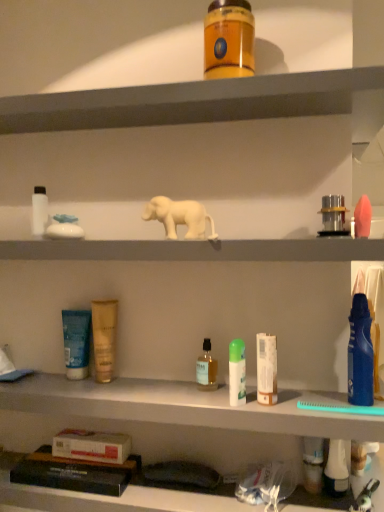
Question: Does pink matte sponge at right, which is the twelfth toiletry in left-to-right order, have a lesser width compared to metallic silver canister at upper right, the 9th toiletry when ordered from left to right?

Choices:
 (A) no
 (B) yes

Answer: (A)

Question: Does pink matte sponge at right, the first toiletry in the right-to-left sequence, have a smaller size compared to metallic silver canister at upper right, the 9th toiletry when ordered from left to right?

Choices:
 (A) yes
 (B) no

Answer: (B)

Question: Does pink matte sponge at right, which is the twelfth toiletry in left-to-right order, have a lesser height compared to metallic silver canister at upper right, positioned as the 4th toiletry in right-to-left order?

Choices:
 (A) no
 (B) yes

Answer: (A)

Question: Is pink matte sponge at right, which is the twelfth toiletry in left-to-right order, looking in the opposite direction of metallic silver canister at upper right, positioned as the 4th toiletry in right-to-left order?

Choices:
 (A) no
 (B) yes

Answer: (A)

Question: Can we say pink matte sponge at right, which is the twelfth toiletry in left-to-right order, lies outside metallic silver canister at upper right, positioned as the 4th toiletry in right-to-left order?

Choices:
 (A) no
 (B) yes

Answer: (B)

Question: Is pink matte sponge at right, which is the twelfth toiletry in left-to-right order, to the left or to the right of metallic silver canister at upper right, the 9th toiletry when ordered from left to right, in the image?

Choices:
 (A) right
 (B) left

Answer: (A)

Question: Is pink matte sponge at right, which is the twelfth toiletry in left-to-right order, taller or shorter than metallic silver canister at upper right, the 9th toiletry when ordered from left to right?

Choices:
 (A) short
 (B) tall

Answer: (A)

Question: From the image's perspective, is pink matte sponge at right, which is the twelfth toiletry in left-to-right order, positioned above or below metallic silver canister at upper right, the 9th toiletry when ordered from left to right?

Choices:
 (A) above
 (B) below

Answer: (B)

Question: Considering the positions of pink matte sponge at right, which is the twelfth toiletry in left-to-right order, and metallic silver canister at upper right, positioned as the 4th toiletry in right-to-left order, in the image, is pink matte sponge at right, which is the twelfth toiletry in left-to-right order, bigger or smaller than metallic silver canister at upper right, positioned as the 4th toiletry in right-to-left order,?

Choices:
 (A) small
 (B) big

Answer: (B)

Question: Is translucent glass bottle at center, placed as the fourth toiletry when sorted from left to right, wider or thinner than white matte bottle at left, marked as the 12th toiletry in a right-to-left arrangement?

Choices:
 (A) thin
 (B) wide

Answer: (A)

Question: Based on their positions, is translucent glass bottle at center, placed as the fourth toiletry when sorted from left to right, located to the left or right of white matte bottle at left, marked as the 12th toiletry in a right-to-left arrangement?

Choices:
 (A) right
 (B) left

Answer: (A)

Question: Considering the positions of translucent glass bottle at center, the 9th toiletry from the right, and white matte bottle at left, the first toiletry viewed from the left, in the image, is translucent glass bottle at center, the 9th toiletry from the right, bigger or smaller than white matte bottle at left, the first toiletry viewed from the left,?

Choices:
 (A) small
 (B) big

Answer: (A)

Question: Is translucent glass bottle at center, placed as the fourth toiletry when sorted from left to right, spatially inside white matte bottle at left, marked as the 12th toiletry in a right-to-left arrangement, or outside of it?

Choices:
 (A) outside
 (B) inside

Answer: (A)

Question: From the image's perspective, is pink matte sponge at right, the first toiletry in the right-to-left sequence, above or below white matte tube at center, marked as the seventh toiletry in a left-to-right arrangement?

Choices:
 (A) below
 (B) above

Answer: (B)

Question: From a real-world perspective, relative to white matte tube at center, marked as the seventh toiletry in a left-to-right arrangement, is pink matte sponge at right, which is the twelfth toiletry in left-to-right order, vertically above or below?

Choices:
 (A) above
 (B) below

Answer: (A)